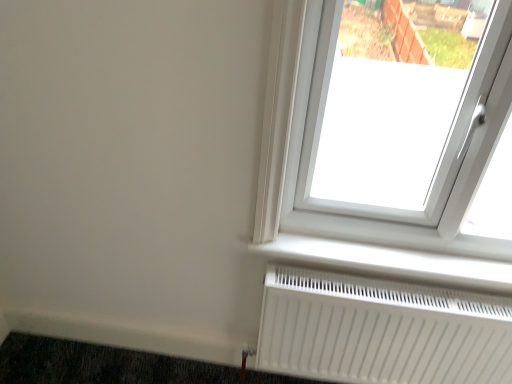
Question: Considering the relative positions of white plastic radiator at lower center and white matte radiator at lower right in the image provided, is white plastic radiator at lower center in front of white matte radiator at lower right?

Choices:
 (A) no
 (B) yes

Answer: (A)

Question: Can white matte radiator at lower right be found inside white plastic radiator at lower center?

Choices:
 (A) no
 (B) yes

Answer: (A)

Question: Does white plastic radiator at lower center have a smaller size compared to white matte radiator at lower right?

Choices:
 (A) yes
 (B) no

Answer: (A)

Question: Considering the relative positions of white plastic radiator at lower center and white matte radiator at lower right in the image provided, is white plastic radiator at lower center to the left of white matte radiator at lower right from the viewer's perspective?

Choices:
 (A) no
 (B) yes

Answer: (B)

Question: Is the surface of white plastic radiator at lower center in direct contact with white matte radiator at lower right?

Choices:
 (A) no
 (B) yes

Answer: (A)

Question: Is white plastic radiator at lower center to the left or to the right of white matte radiator at lower right in the image?

Choices:
 (A) left
 (B) right

Answer: (A)

Question: Considering the positions of white plastic radiator at lower center and white matte radiator at lower right in the image, is white plastic radiator at lower center bigger or smaller than white matte radiator at lower right?

Choices:
 (A) small
 (B) big

Answer: (A)

Question: Is point (386, 248) positioned closer to the camera than point (329, 319)?

Choices:
 (A) closer
 (B) farther

Answer: (A)

Question: In terms of height, does white plastic radiator at lower center look taller or shorter compared to white matte radiator at lower right?

Choices:
 (A) short
 (B) tall

Answer: (A)

Question: From the image's perspective, is white matte radiator at lower right located above or below dark gray carpet at lower left?

Choices:
 (A) below
 (B) above

Answer: (B)

Question: Is white matte radiator at lower right taller or shorter than dark gray carpet at lower left?

Choices:
 (A) tall
 (B) short

Answer: (A)

Question: Does point (261, 344) appear closer or farther from the camera than point (62, 339)?

Choices:
 (A) closer
 (B) farther

Answer: (A)

Question: Based on their sizes in the image, would you say white matte radiator at lower right is bigger or smaller than dark gray carpet at lower left?

Choices:
 (A) small
 (B) big

Answer: (B)

Question: Is dark gray carpet at lower left taller or shorter than white plastic radiator at lower center?

Choices:
 (A) short
 (B) tall

Answer: (B)

Question: From a real-world perspective, is dark gray carpet at lower left above or below white plastic radiator at lower center?

Choices:
 (A) below
 (B) above

Answer: (A)